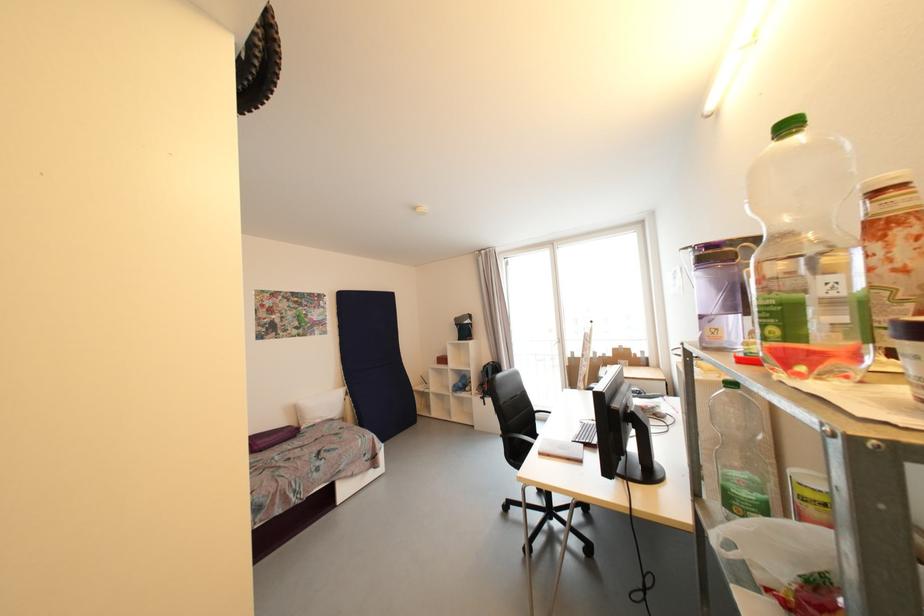
What do you see at coordinates (807, 257) in the screenshot? The image size is (924, 616). I see `a large plastic bottle` at bounding box center [807, 257].